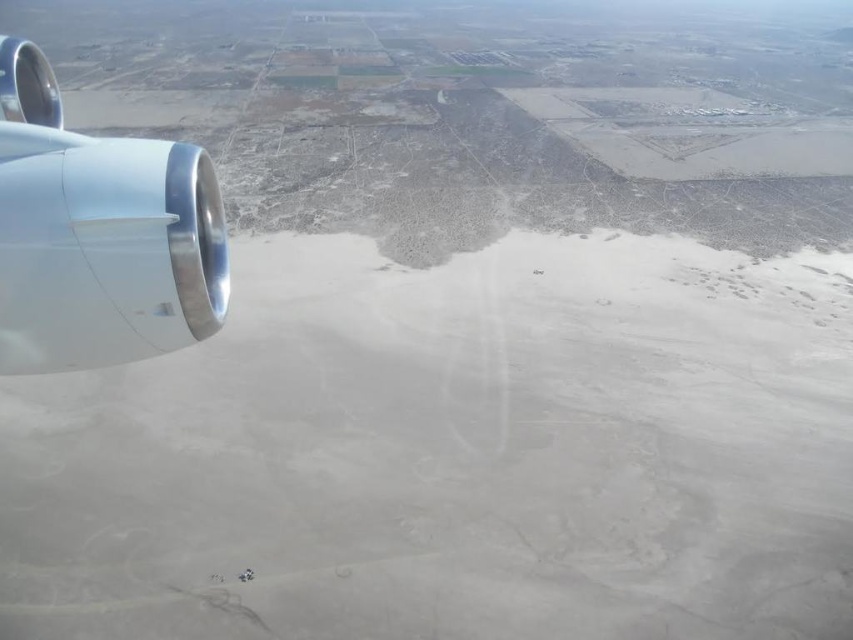
Is metallic silver engine at left closer to the viewer compared to polished chrome airplane engine at left?

Yes, it is.

Which is behind, point (102, 310) or point (16, 52)?

The point (16, 52) is behind.

What do you see at coordinates (97, 234) in the screenshot?
I see `metallic silver engine at left` at bounding box center [97, 234].

Locate an element on the screen. Image resolution: width=853 pixels, height=640 pixels. metallic silver engine at left is located at coordinates (97, 234).

Which is below, white sand at left or metallic silver engine at left?

white sand at left is below.

Is point (505, 403) closer to viewer compared to point (55, 228)?

No, (505, 403) is further to viewer.

This screenshot has height=640, width=853. Identify the location of white sand at left. (453, 452).

Measure the distance between point (416,531) and camera.

Point (416,531) and camera are 36.50 meters apart from each other.

The height and width of the screenshot is (640, 853). In order to click on white sand at left in this screenshot , I will do `click(453, 452)`.

Where is `white sand at left`? The width and height of the screenshot is (853, 640). white sand at left is located at coordinates (453, 452).